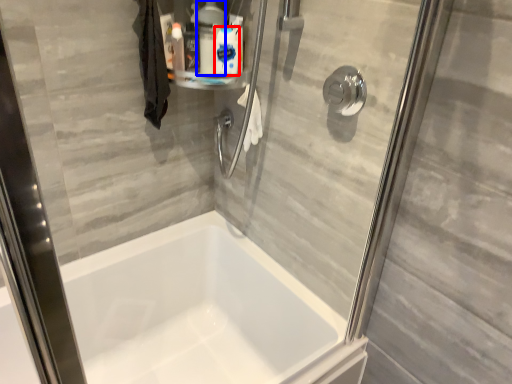
Question: Which object appears farthest to the camera in this image, cleaning product (highlighted by a red box) or cleaning product (highlighted by a blue box)?

Choices:
 (A) cleaning product
 (B) cleaning product

Answer: (A)